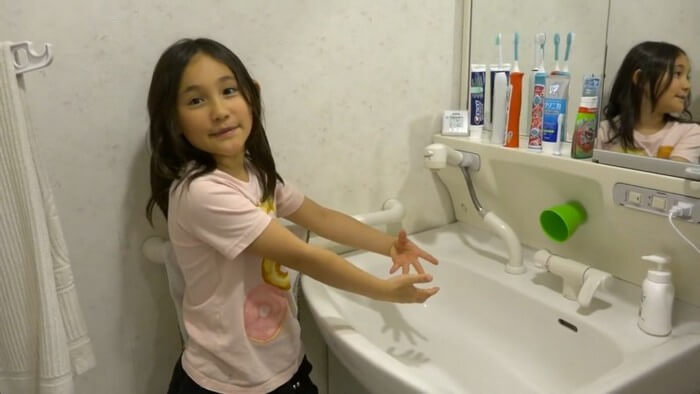
At what (x,y) coordinates should I click in order to perform the action: click on towel. Please return your answer as a coordinate pair (x, y). Looking at the image, I should click on (35, 320).